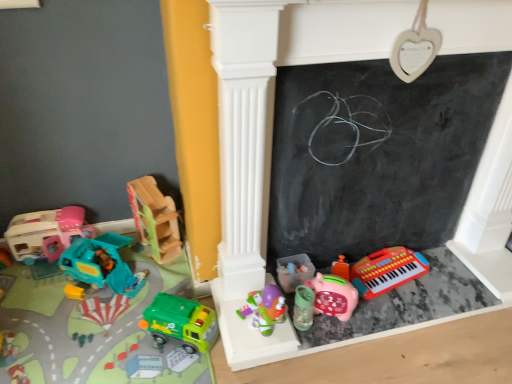
Where is `vacant point to the left of teal plastic truck at left, the 6th toy in the right-to-left sequence`? vacant point to the left of teal plastic truck at left, the 6th toy in the right-to-left sequence is located at coordinates (32, 289).